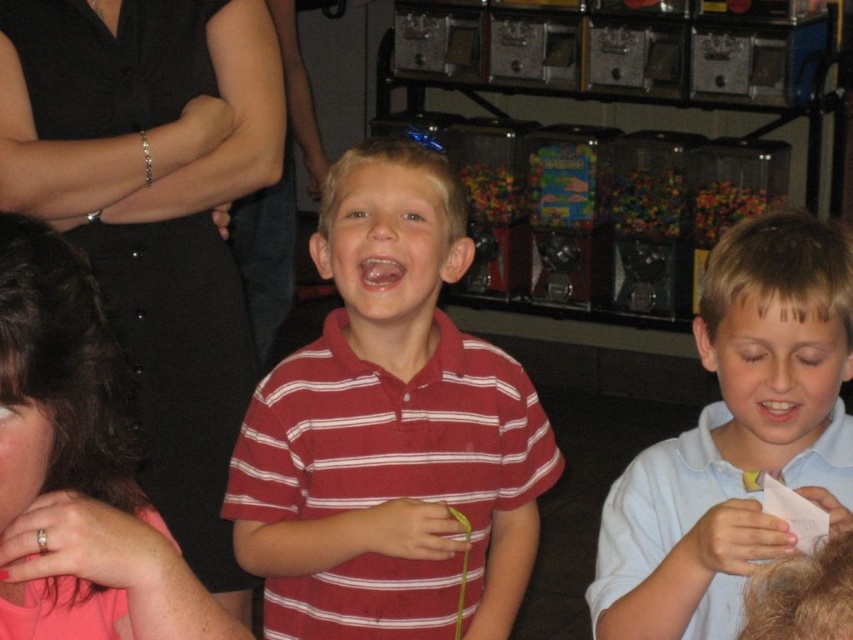
You are organizing a party and need to place decorations. You have a striped cotton shirt at center and translucent plastic gumballs at center. Which object is wider?

The striped cotton shirt at center is wider than the translucent plastic gumballs at center.

You are a photographer at the party and need to capture a photo that includes both the pink matte shirt at lower left and the translucent plastic gumballs at center. Based on their sizes, which object should you ensure is closer to the camera to include both in the frame without cropping?

The pink matte shirt at lower left has a lesser width compared to the translucent plastic gumballs at center, so to include both in the frame without cropping, you should position the pink matte shirt at lower left closer to the camera since it is smaller and requires less space.